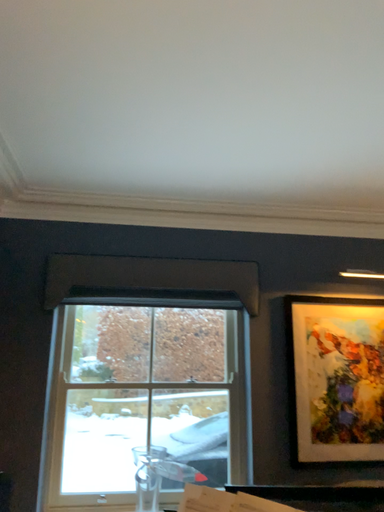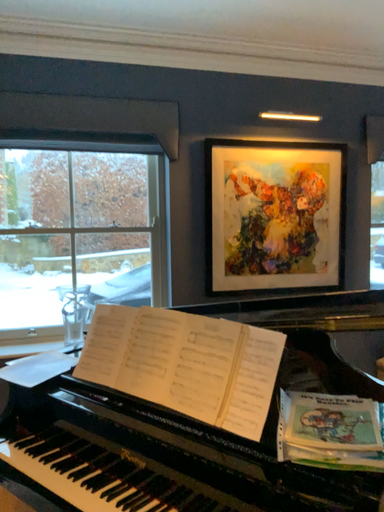
Question: How did the camera likely rotate when shooting the video?

Choices:
 (A) rotated upward
 (B) rotated downward

Answer: (B)